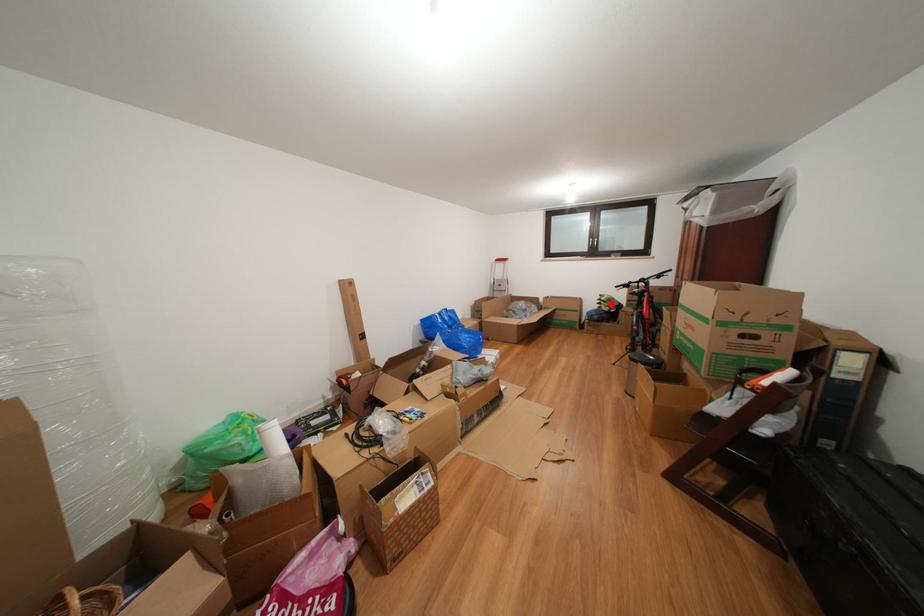
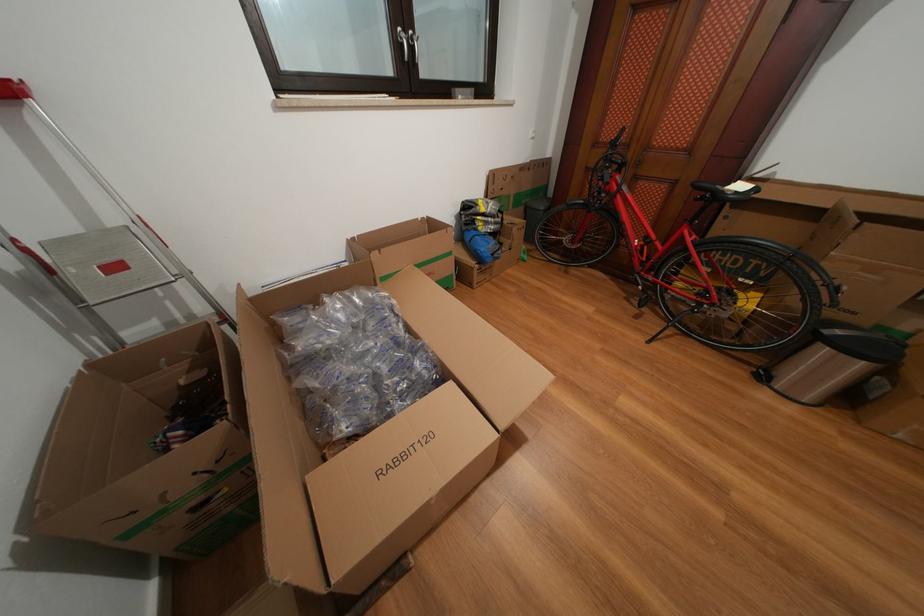
Locate, in the second image, the point that corresponds to the highlighted location in the first image.

(491, 215)